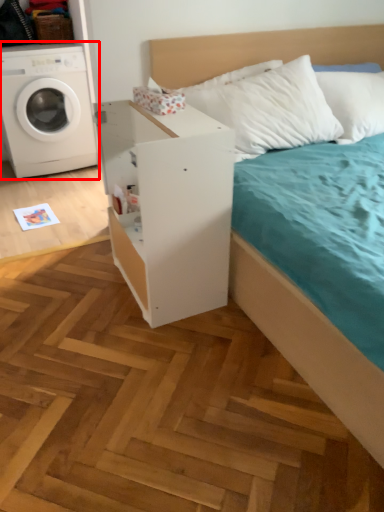
Question: Observing the image, what is the correct spatial positioning of washing machine (annotated by the red box) in reference to dresser?

Choices:
 (A) left
 (B) right

Answer: (A)